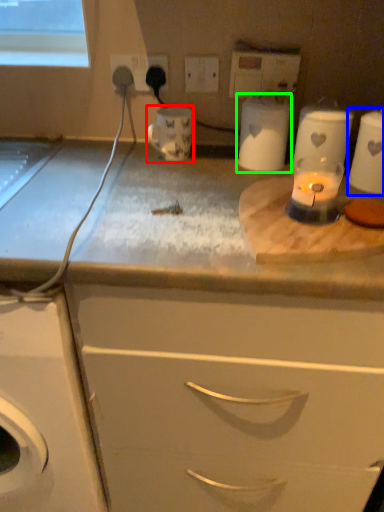
Question: Which is nearer to the appliance (highlighted by a red box)? appliance (highlighted by a blue box) or appliance (highlighted by a green box).

Choices:
 (A) appliance
 (B) appliance

Answer: (B)